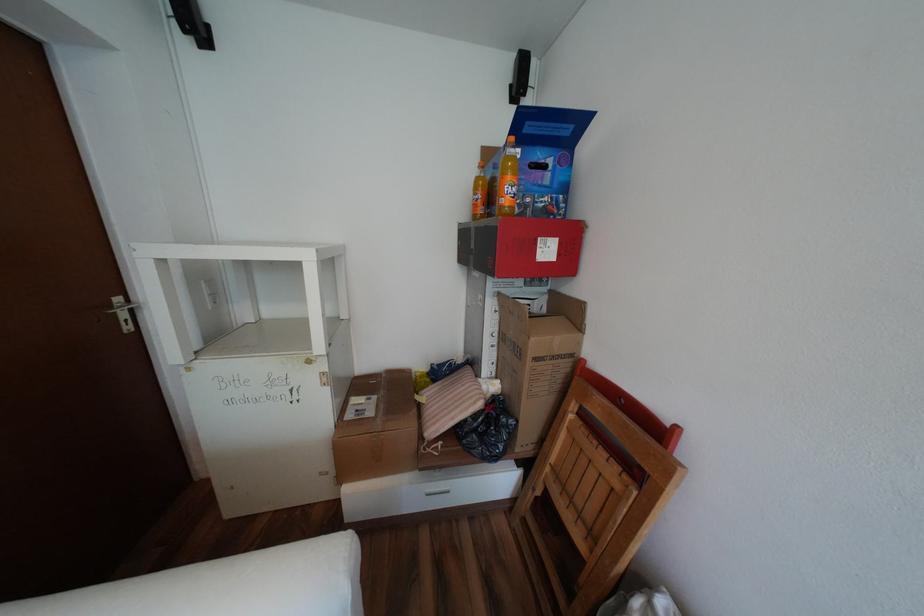
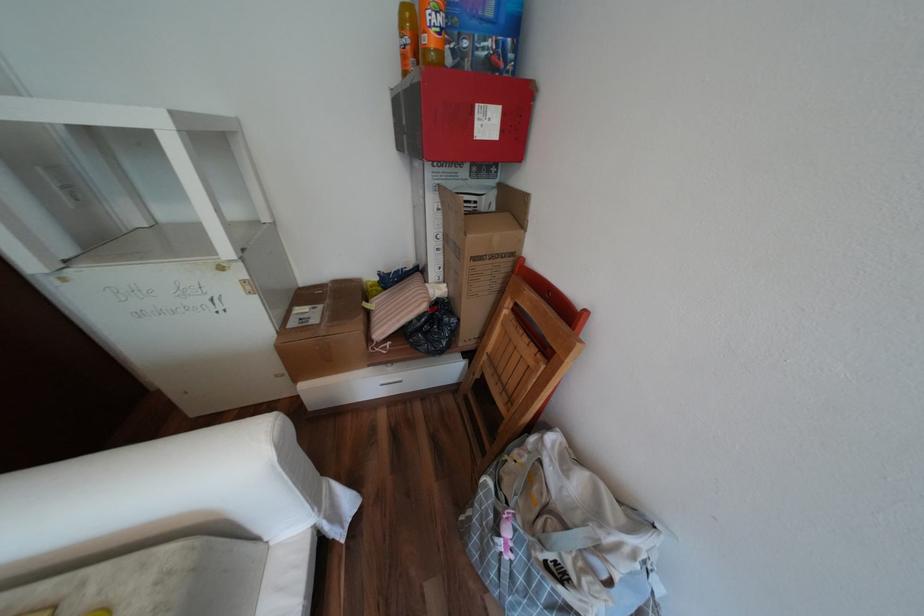
Question: In a continuous first-person perspective shot, in which direction is the camera moving?

Choices:
 (A) Left
 (B) Right
 (C) Forward
 (D) Backward

Answer: (B)